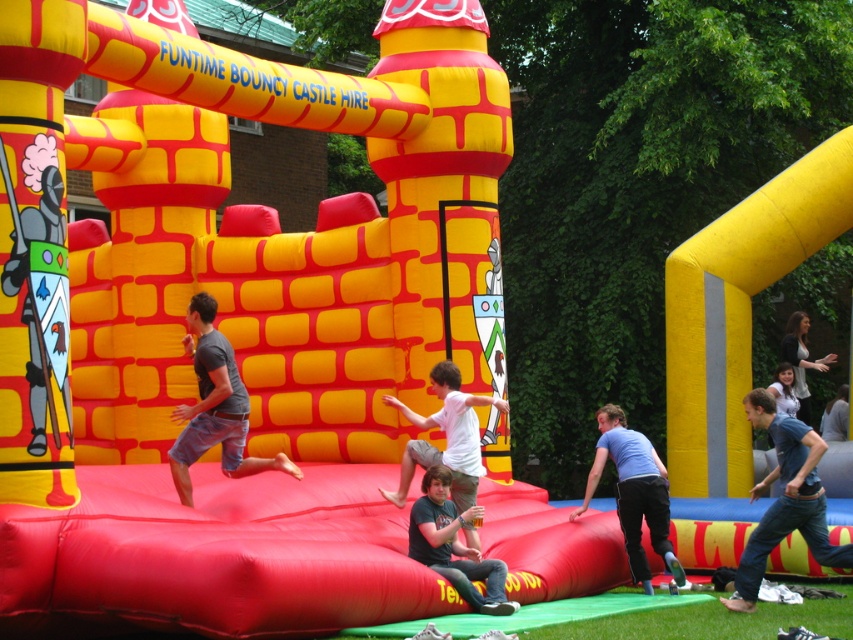
Question: Which point is farther to the camera?

Choices:
 (A) white matte shirt at center
 (B) light brown hair at upper right
 (C) jeans at center
 (D) blue cotton shirt at lower right

Answer: (B)

Question: Among these objects, which one is nearest to the camera?

Choices:
 (A) jeans at center
 (B) blue cotton shirt at lower right
 (C) white matte shirt at center

Answer: (A)

Question: Observing the image, what is the correct spatial positioning of jeans at center in reference to light brown hair at upper right?

Choices:
 (A) left
 (B) right

Answer: (A)

Question: Considering the real-world distances, which object is closest to the white matte shirt at center?

Choices:
 (A) jeans at center
 (B) blue jeans at center

Answer: (A)

Question: Does white matte shirt at center have a smaller size compared to light brown hair at upper right?

Choices:
 (A) yes
 (B) no

Answer: (A)

Question: Does blue cotton shirt at lower right have a smaller size compared to white matte shirt at center?

Choices:
 (A) no
 (B) yes

Answer: (A)